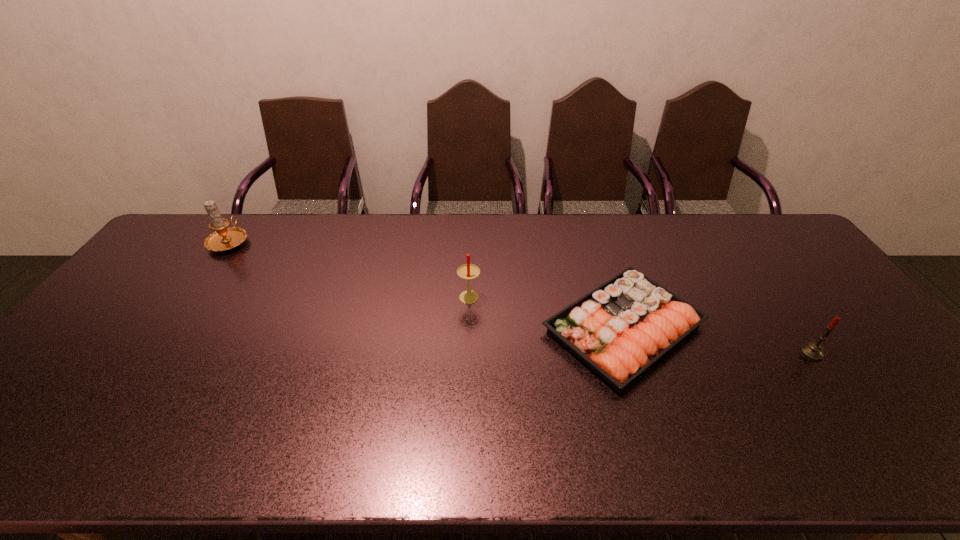
The width and height of the screenshot is (960, 540). In order to click on free location located on the back of the shortest candle in this screenshot , I will do `click(775, 300)`.

This screenshot has width=960, height=540. I want to click on vacant space situated 0.350m on the right of the second object from right to left, so click(x=834, y=328).

Image resolution: width=960 pixels, height=540 pixels. Find the location of `object that is positioned at the far edge`. object that is positioned at the far edge is located at coordinates (223, 239).

Where is `object that is positioned at the left edge`? The width and height of the screenshot is (960, 540). object that is positioned at the left edge is located at coordinates (223, 239).

Where is `object that is at the far left corner`? object that is at the far left corner is located at coordinates (223, 239).

At what (x,y) coordinates should I click in order to perform the action: click on vacant space at the far edge of the desktop. Please return your answer as a coordinate pair (x, y). Looking at the image, I should click on (328, 244).

Locate an element on the screen. blank space at the near edge of the desktop is located at coordinates (765, 456).

This screenshot has width=960, height=540. I want to click on vacant space at the left edge of the desktop, so click(180, 287).

In the image, there is a desktop. At what (x,y) coordinates should I click in order to perform the action: click on vacant space at the near left corner. Please return your answer as a coordinate pair (x, y). This screenshot has height=540, width=960. Looking at the image, I should click on (20, 447).

Find the location of a particular element. The image size is (960, 540). free space between the second candle from left to right and the leftmost candle is located at coordinates (349, 268).